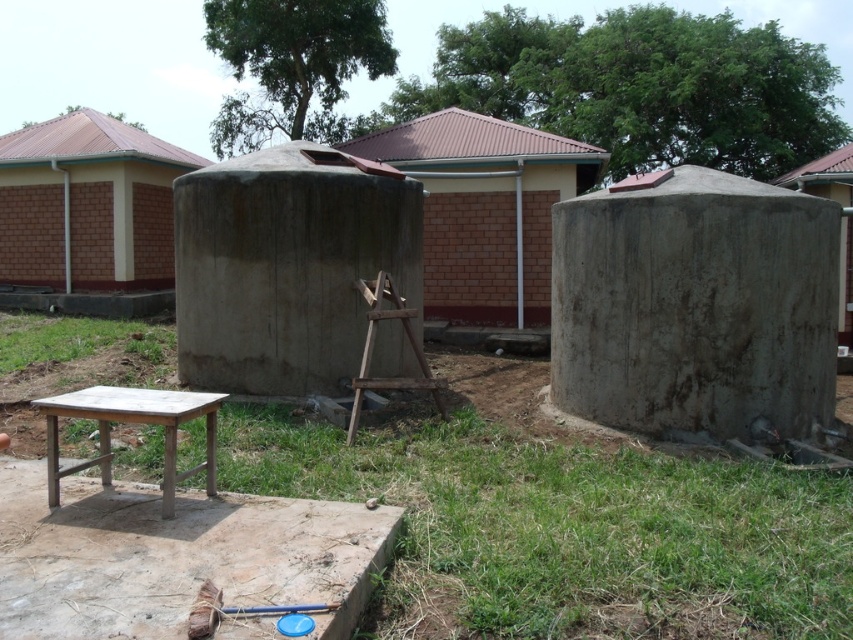
Question: Is the position of concrete hut at center less distant than that of wooden table at lower left?

Choices:
 (A) no
 (B) yes

Answer: (A)

Question: Is brown brick wall at left further to camera compared to wooden table at lower left?

Choices:
 (A) no
 (B) yes

Answer: (B)

Question: Among these objects, which one is farthest from the camera?

Choices:
 (A) gray concrete tank at center
 (B) wooden table at lower left

Answer: (A)

Question: Is concrete hut at center above wooden table at lower left?

Choices:
 (A) no
 (B) yes

Answer: (B)

Question: Which of the following is the closest to the observer?

Choices:
 (A) gray concrete tank at center
 (B) wooden table at lower left
 (C) concrete hut at center
 (D) brown brick wall at left

Answer: (B)

Question: Among these points, which one is farthest from the camera?

Choices:
 (A) (531, 177)
 (B) (32, 177)

Answer: (B)